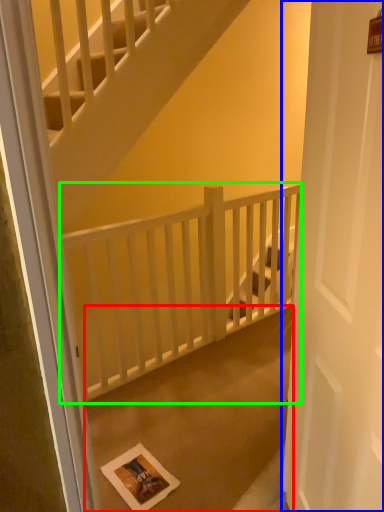
Question: Considering the real-world distances, which object is closest to concrete (highlighted by a red box)? door (highlighted by a blue box) or balustrade (highlighted by a green box).

Choices:
 (A) door
 (B) balustrade

Answer: (B)